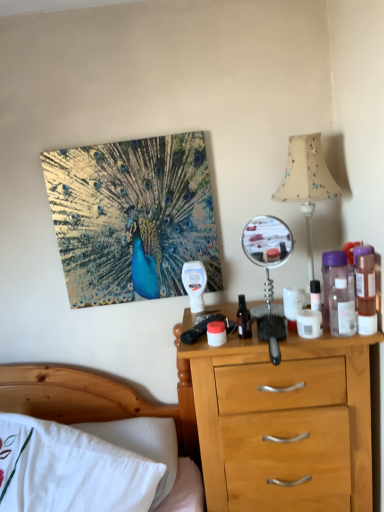
Question: From a real-world perspective, is transparent plastic bottle at right, acting as the 2th bottle starting from the right, above or below beige fabric lampshade at upper right?

Choices:
 (A) above
 (B) below

Answer: (B)

Question: In terms of width, does transparent plastic bottle at right, acting as the 2th bottle starting from the right, look wider or thinner when compared to beige fabric lampshade at upper right?

Choices:
 (A) thin
 (B) wide

Answer: (A)

Question: Which object is the farthest from the purple translucent bottle at right, which ranks as the second bottle in left-to-right order?

Choices:
 (A) transparent plastic bottle at right, which is the third bottle from left to right
 (B) black plastic remote control at center
 (C) metallic silver mirror at upper right
 (D) white cotton bed at lower left
 (E) shiny metallic peacock at upper left

Answer: (D)

Question: Which of these objects is positioned farthest from the white cotton bed at lower left?

Choices:
 (A) black plastic remote control at center
 (B) translucent plastic bottle at right, the 1th bottle when ordered from right to left
 (C) transparent plastic bottle at right, which is the third bottle from left to right
 (D) shiny metallic peacock at upper left
 (E) white matte jar at center

Answer: (B)